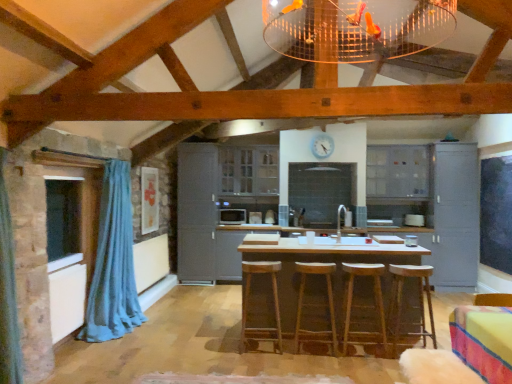
Question: Is wooden bar stool at center, which is the 3th bar stool from left to right, not close to satin black microwave at center?

Choices:
 (A) yes
 (B) no

Answer: (A)

Question: Is wooden bar stool at center, which is the 3th bar stool from left to right, turned away from satin black microwave at center?

Choices:
 (A) yes
 (B) no

Answer: (B)

Question: From the image's perspective, does wooden bar stool at center, which is the 3th bar stool from left to right, appear higher than satin black microwave at center?

Choices:
 (A) no
 (B) yes

Answer: (A)

Question: From a real-world perspective, is wooden bar stool at center, which is the 3th bar stool from left to right, on top of satin black microwave at center?

Choices:
 (A) yes
 (B) no

Answer: (B)

Question: Would you say satin black microwave at center is part of wooden bar stool at center, the 2th bar stool from the right,'s contents?

Choices:
 (A) yes
 (B) no

Answer: (B)

Question: From the image's perspective, is wooden bar stool at center, which is the 3th bar stool from left to right, located beneath satin black microwave at center?

Choices:
 (A) no
 (B) yes

Answer: (B)

Question: Is wooden bar stool at center, arranged as the 3th bar stool when viewed from the right, behind wooden bar stool at center, placed as the fourth bar stool when sorted from left to right?

Choices:
 (A) yes
 (B) no

Answer: (A)

Question: Is wooden bar stool at center, positioned as the second bar stool in left-to-right order, wider than wooden bar stool at center, marked as the 1th bar stool in a right-to-left arrangement?

Choices:
 (A) no
 (B) yes

Answer: (A)

Question: Is wooden bar stool at center, positioned as the second bar stool in left-to-right order, positioned with its back to wooden bar stool at center, placed as the fourth bar stool when sorted from left to right?

Choices:
 (A) yes
 (B) no

Answer: (B)

Question: Considering the relative sizes of wooden bar stool at center, arranged as the 3th bar stool when viewed from the right, and wooden bar stool at center, placed as the fourth bar stool when sorted from left to right, in the image provided, is wooden bar stool at center, arranged as the 3th bar stool when viewed from the right, bigger than wooden bar stool at center, placed as the fourth bar stool when sorted from left to right,?

Choices:
 (A) no
 (B) yes

Answer: (A)

Question: From the image's perspective, is wooden bar stool at center, positioned as the second bar stool in left-to-right order, over wooden bar stool at center, placed as the fourth bar stool when sorted from left to right?

Choices:
 (A) no
 (B) yes

Answer: (B)

Question: Is wooden bar stool at center, arranged as the 3th bar stool when viewed from the right, far away from wooden bar stool at center, placed as the fourth bar stool when sorted from left to right?

Choices:
 (A) no
 (B) yes

Answer: (A)

Question: From the image's perspective, is wooden bar stool at center, placed as the fourth bar stool when sorted from left to right, above brown wooden bar stool at center, placed as the 1th bar stool when sorted from left to right?

Choices:
 (A) no
 (B) yes

Answer: (A)